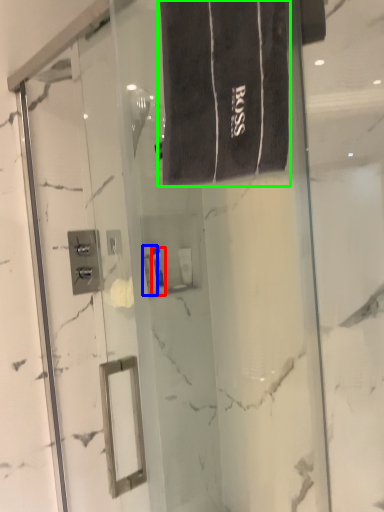
Question: Which object is the closest to the toiletry (highlighted by a red box)? Choose among these: toiletry (highlighted by a blue box) or bath towel (highlighted by a green box).

Choices:
 (A) toiletry
 (B) bath towel

Answer: (A)